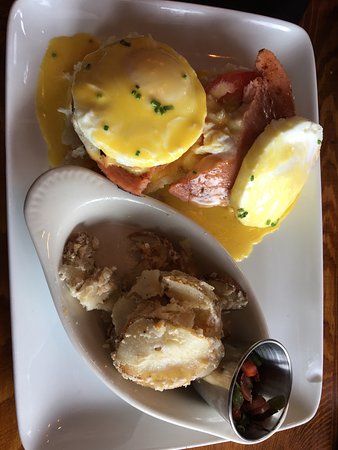
Identify the location of tables. (319, 436), (8, 430), (312, 20).